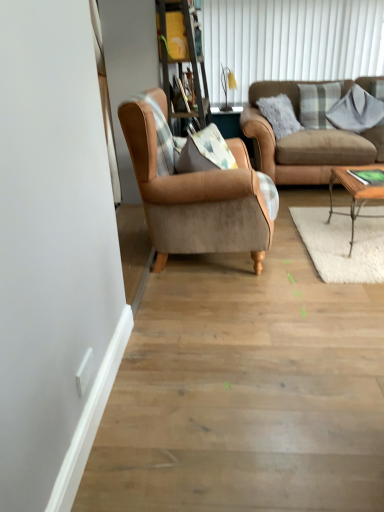
Question: Can you confirm if white textured shutter at upper center is shorter than matte yellow lampshade at upper center?

Choices:
 (A) yes
 (B) no

Answer: (B)

Question: Does white textured shutter at upper center have a lesser width compared to matte yellow lampshade at upper center?

Choices:
 (A) no
 (B) yes

Answer: (B)

Question: Is white textured shutter at upper center taller than matte yellow lampshade at upper center?

Choices:
 (A) yes
 (B) no

Answer: (A)

Question: Is white textured shutter at upper center not inside matte yellow lampshade at upper center?

Choices:
 (A) yes
 (B) no

Answer: (A)

Question: From the image's perspective, is white textured shutter at upper center over matte yellow lampshade at upper center?

Choices:
 (A) yes
 (B) no

Answer: (A)

Question: Is white textured shutter at upper center aimed at matte yellow lampshade at upper center?

Choices:
 (A) yes
 (B) no

Answer: (A)

Question: Does suede brown armchair at center have a smaller size compared to brown leather couch at upper right?

Choices:
 (A) yes
 (B) no

Answer: (A)

Question: Is brown leather couch at upper right at the back of suede brown armchair at center?

Choices:
 (A) yes
 (B) no

Answer: (B)

Question: From the image's perspective, is suede brown armchair at center located beneath brown leather couch at upper right?

Choices:
 (A) yes
 (B) no

Answer: (A)

Question: Does suede brown armchair at center appear on the right side of brown leather couch at upper right?

Choices:
 (A) yes
 (B) no

Answer: (B)

Question: Can you confirm if suede brown armchair at center is bigger than brown leather couch at upper right?

Choices:
 (A) yes
 (B) no

Answer: (B)

Question: Is suede brown armchair at center further to the viewer compared to brown leather couch at upper right?

Choices:
 (A) no
 (B) yes

Answer: (A)

Question: Is woodenwoodencoffee table at right positioned beyond the bounds of wooden bookshelf at upper center?

Choices:
 (A) yes
 (B) no

Answer: (A)